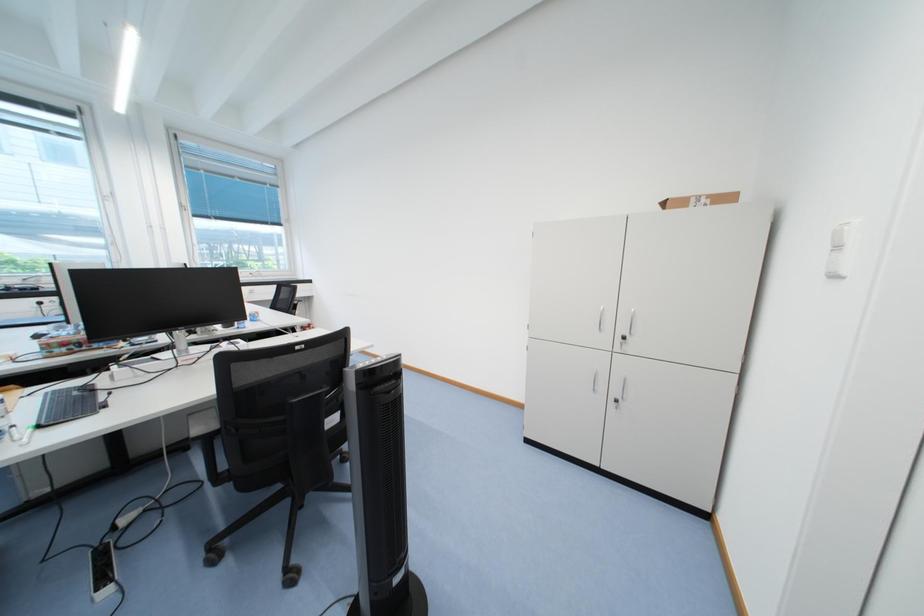
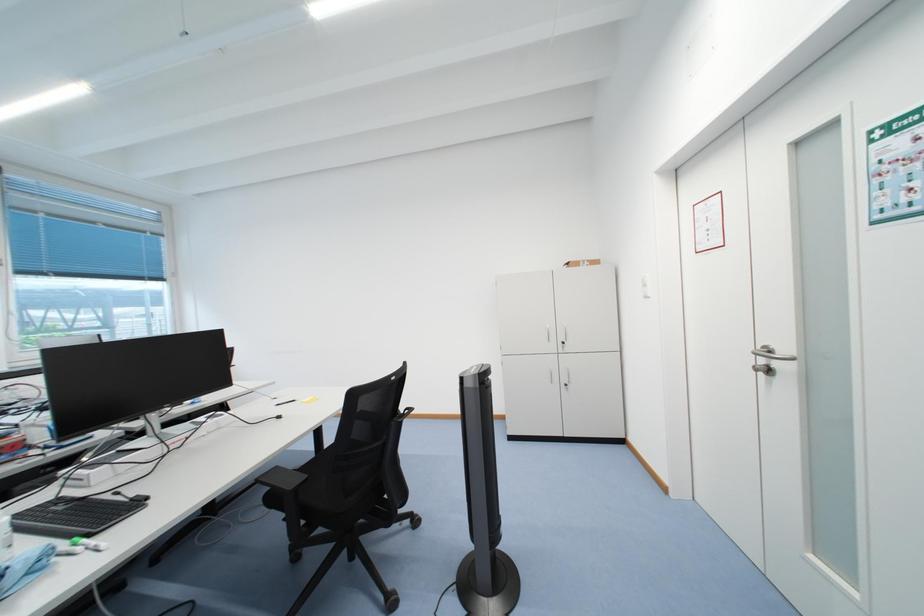
In a continuous first-person perspective shot, in which direction is the camera moving?

The movement direction of the cameraman is left, backward.